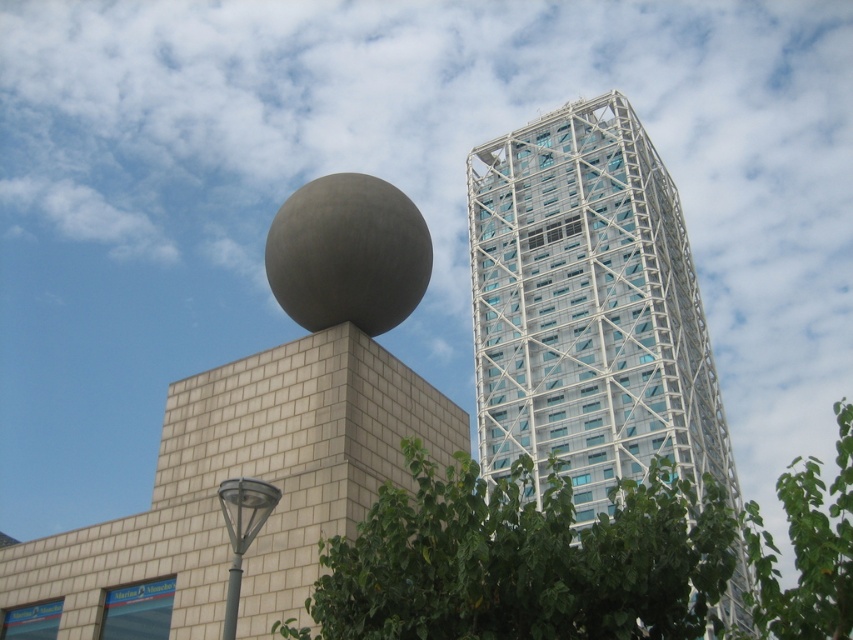
Question: Is white glass building at upper center to the right of green leafy tree at center from the viewer's perspective?

Choices:
 (A) yes
 (B) no

Answer: (B)

Question: Does green leafy tree at center lie in front of metallic gray streetlight at lower left?

Choices:
 (A) yes
 (B) no

Answer: (A)

Question: Among these points, which one is nearest to the camera?

Choices:
 (A) (526, 246)
 (B) (229, 618)
 (C) (422, 452)

Answer: (C)

Question: Is green leafy tree at center closer to the viewer compared to metallic gray streetlight at lower left?

Choices:
 (A) yes
 (B) no

Answer: (A)

Question: Which of the following is the farthest from the observer?

Choices:
 (A) metallic gray streetlight at lower left
 (B) white glass building at upper center

Answer: (B)

Question: Based on their relative distances, which object is farther from the metallic gray streetlight at lower left?

Choices:
 (A) white glass building at upper center
 (B) green leafy tree at center

Answer: (A)